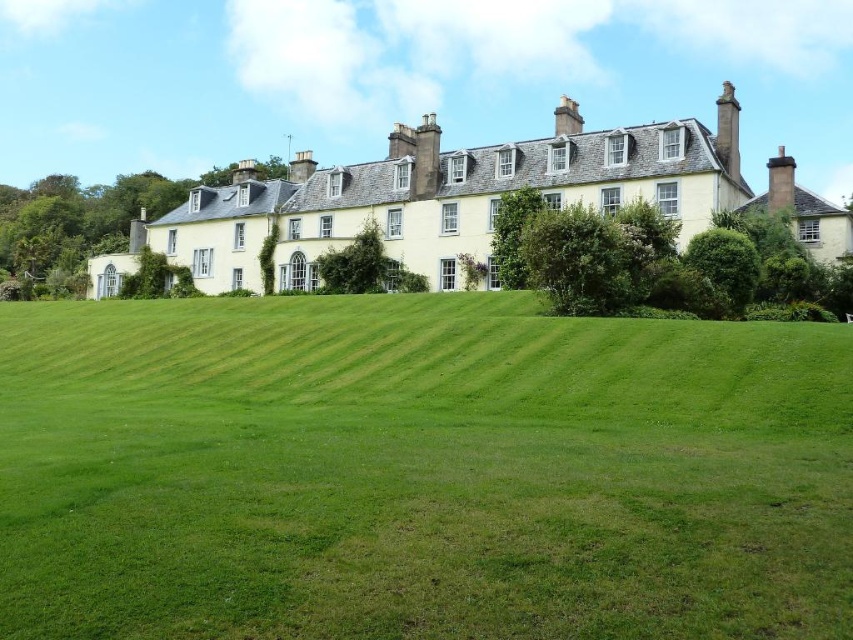
Question: Is green grass at center thinner than yellow stone building at center?

Choices:
 (A) yes
 (B) no

Answer: (A)

Question: Is green grass at center bigger than yellow stone building at center?

Choices:
 (A) yes
 (B) no

Answer: (B)

Question: Which of the following is the farthest from the observer?

Choices:
 (A) yellow stone building at center
 (B) green grass at center

Answer: (A)

Question: Among these points, which one is nearest to the camera?

Choices:
 (A) (689, 193)
 (B) (74, 481)

Answer: (B)

Question: Can you confirm if green grass at center is positioned below yellow stone building at center?

Choices:
 (A) no
 (B) yes

Answer: (B)